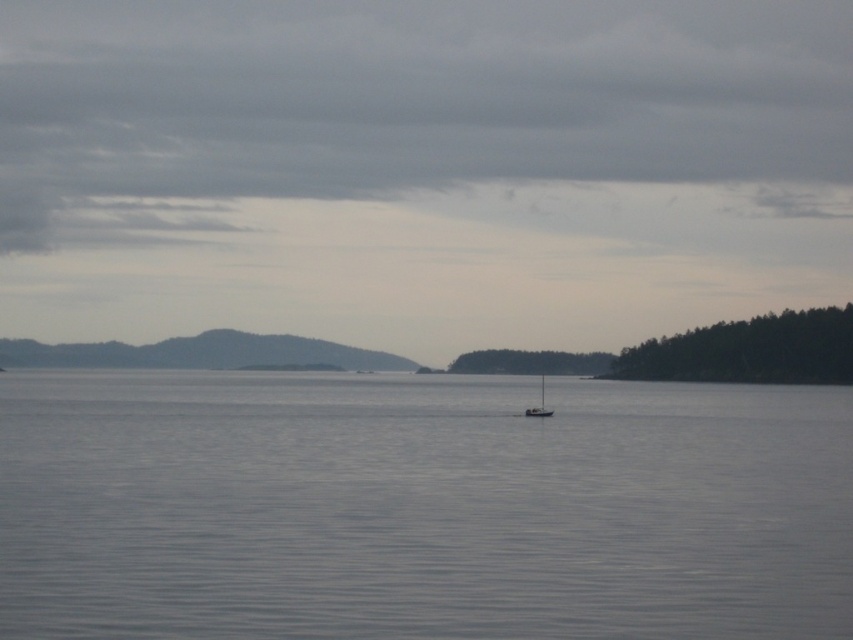
Question: Which point is farther to the camera?

Choices:
 (A) coord(634,486)
 (B) coord(543,387)

Answer: (B)

Question: Can you confirm if clear water at center is smaller than white matte sailboat at center?

Choices:
 (A) no
 (B) yes

Answer: (A)

Question: Is clear water at center thinner than white matte sailboat at center?

Choices:
 (A) yes
 (B) no

Answer: (B)

Question: Is clear water at center in front of white matte sailboat at center?

Choices:
 (A) no
 (B) yes

Answer: (B)